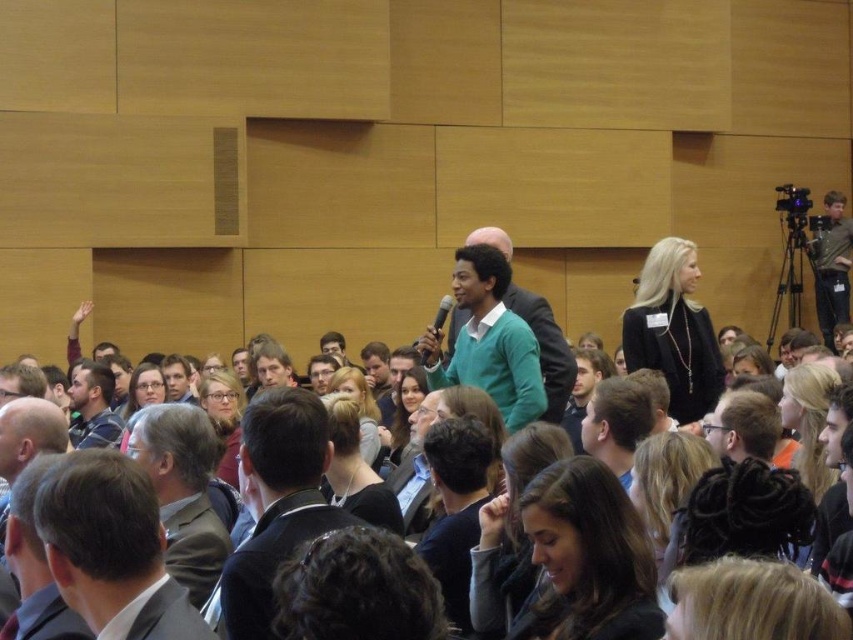
Question: From the image, what is the correct spatial relationship of green matte sweater at center in relation to matte black camera at upper right?

Choices:
 (A) left
 (B) right

Answer: (A)

Question: Does dark brown suit at center appear on the left side of light brown hair at center?

Choices:
 (A) no
 (B) yes

Answer: (B)

Question: Estimate the real-world distances between objects in this image. Which object is closer to the matte black camera at upper right?

Choices:
 (A) light brown hair at center
 (B) brown leather jacket at center

Answer: (A)

Question: Based on their relative distances, which object is farther from the matte black camera at upper right?

Choices:
 (A) dark brown suit at lower left
 (B) brown leather jacket at center
 (C) green matte sweater at center
 (D) dark brown suit at center

Answer: (A)

Question: Based on their relative distances, which object is farther from the brown leather jacket at center?

Choices:
 (A) matte black camera at upper right
 (B) green matte sweater at center
 (C) dark blue sweater at center
 (D) dark brown suit at lower left

Answer: (A)

Question: Does brown leather jacket at center have a smaller size compared to matte black camera at upper right?

Choices:
 (A) no
 (B) yes

Answer: (A)